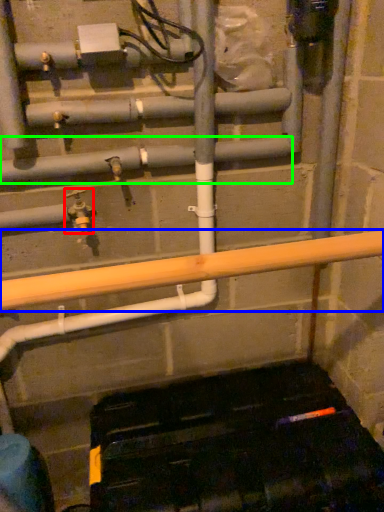
Question: Considering the real-world distances, which object is farthest from plumbing fixture (highlighted by a red box)? beam (highlighted by a blue box) or pipe (highlighted by a green box)?

Choices:
 (A) beam
 (B) pipe

Answer: (A)